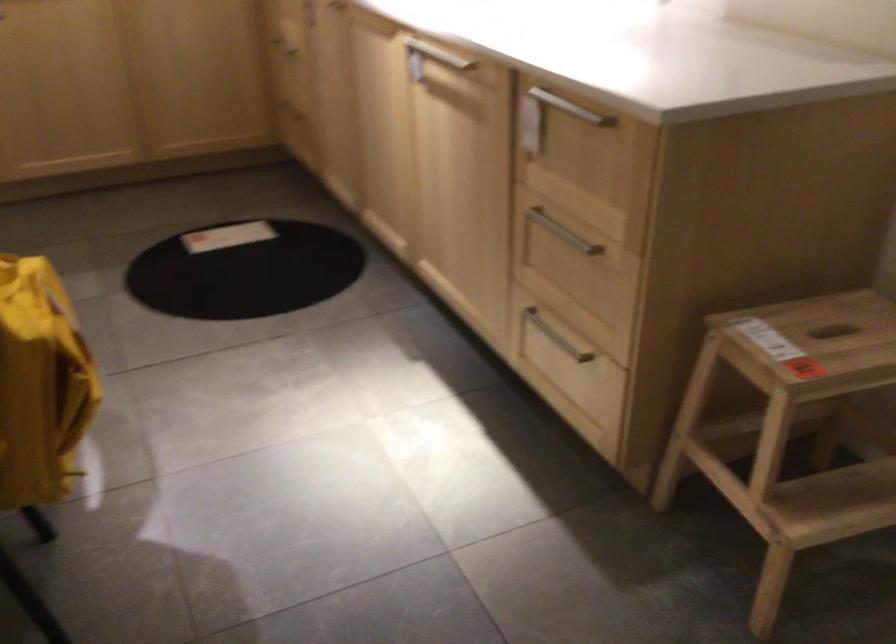
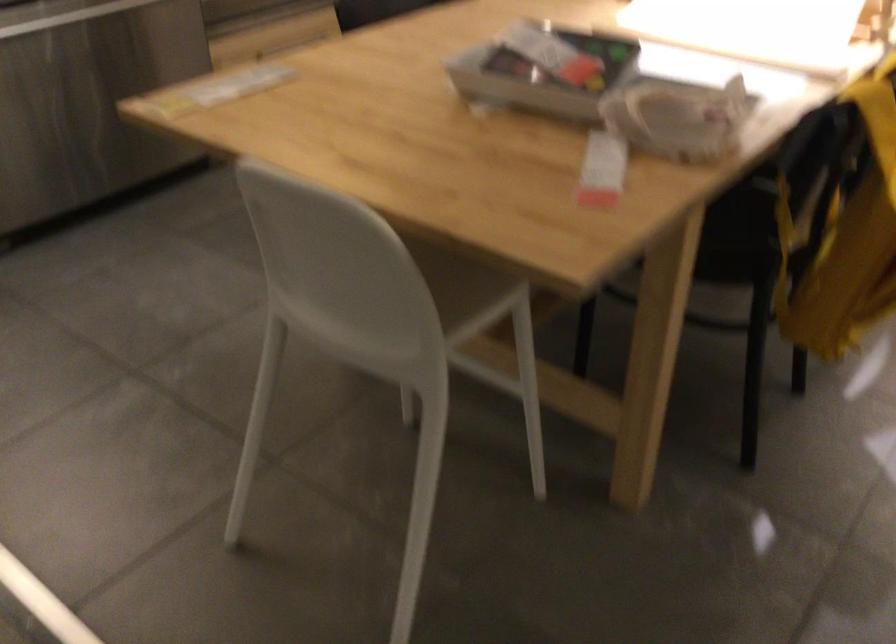
The images are taken continuously from a first-person perspective. In which direction is your viewpoint rotating?

The rotation direction of the camera is left-down.